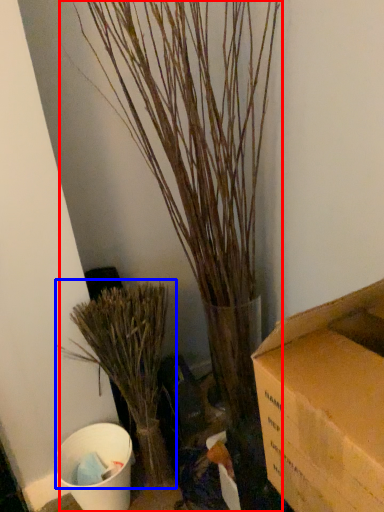
Question: Which point is further to the camera, houseplant (highlighted by a red box) or houseplant (highlighted by a blue box)?

Choices:
 (A) houseplant
 (B) houseplant

Answer: (B)